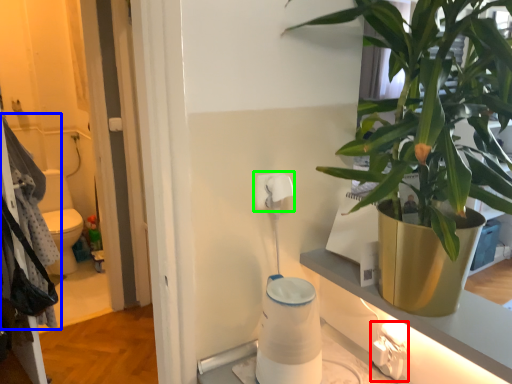
Question: Which object is positioned closest to electric outlet (highlighted by a red box)? Select from laundry (highlighted by a blue box) and toilet paper (highlighted by a green box).

Choices:
 (A) laundry
 (B) toilet paper

Answer: (B)